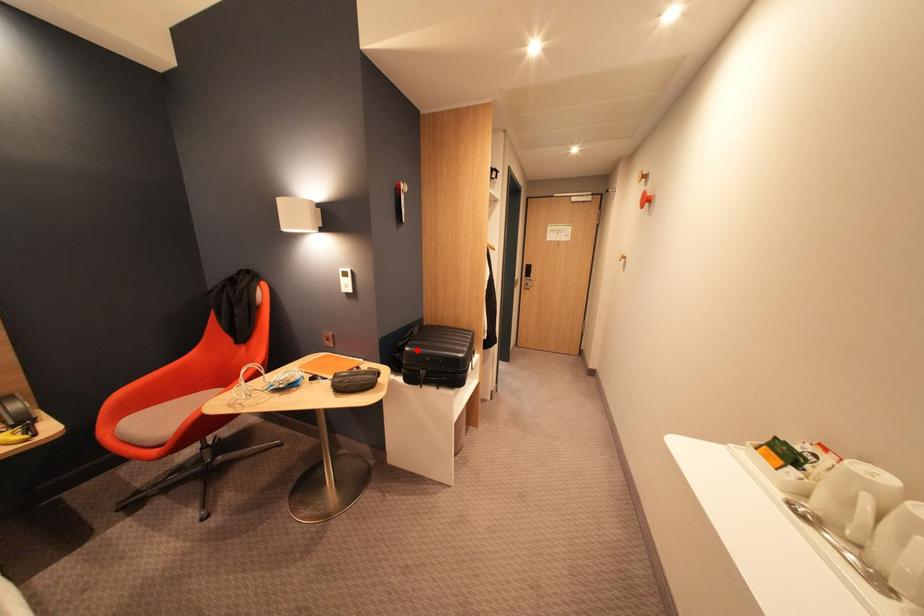
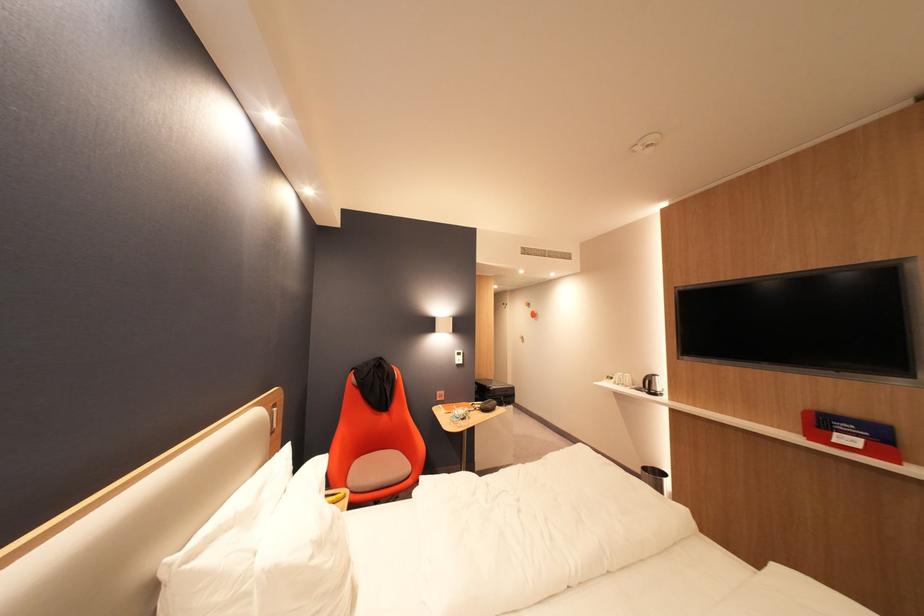
Question: A red point is marked in image1. In image2, is the corresponding 3D point closer to the camera or farther? Reply with the corresponding letter.

Choices:
 (A) The corresponding 3D point is closer.
 (B) The corresponding 3D point is farther.

Answer: (A)